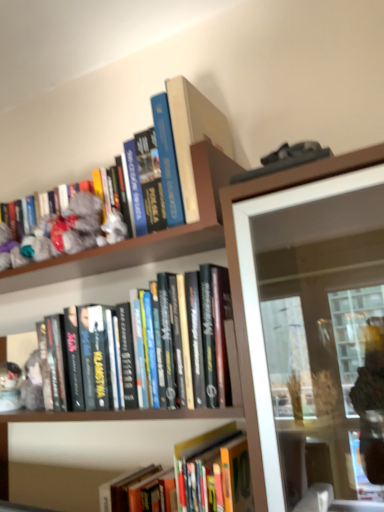
Question: Is hardcover books at center, which ranks as the 2th book in bottom-to-top order, oriented away from hardcover book at upper center, which appears as the 2th book when viewed from the top?

Choices:
 (A) yes
 (B) no

Answer: (B)

Question: From the image's perspective, is hardcover books at center, acting as the 3th book starting from the top, above hardcover book at upper center, the 3th book from the bottom?

Choices:
 (A) yes
 (B) no

Answer: (B)

Question: Is hardcover books at center, which ranks as the 2th book in bottom-to-top order, shorter than hardcover book at upper center, the 3th book from the bottom?

Choices:
 (A) no
 (B) yes

Answer: (A)

Question: Considering the relative sizes of hardcover books at center, which ranks as the 2th book in bottom-to-top order, and hardcover book at upper center, which appears as the 2th book when viewed from the top, in the image provided, is hardcover books at center, which ranks as the 2th book in bottom-to-top order, thinner than hardcover book at upper center, which appears as the 2th book when viewed from the top,?

Choices:
 (A) yes
 (B) no

Answer: (A)

Question: Is hardcover books at center, acting as the 3th book starting from the top, at the left side of hardcover book at upper center, the 3th book from the bottom?

Choices:
 (A) no
 (B) yes

Answer: (A)

Question: Is hardcover books at center, acting as the 3th book starting from the top, not near hardcover book at upper center, which appears as the 2th book when viewed from the top?

Choices:
 (A) no
 (B) yes

Answer: (A)

Question: Can we say fuzzy fabric toy at upper left lies outside hardcover book at upper center, the 1th book when ordered from top to bottom?

Choices:
 (A) yes
 (B) no

Answer: (A)

Question: Considering the relative sizes of fuzzy fabric toy at upper left and hardcover book at upper center, the 1th book when ordered from top to bottom, in the image provided, is fuzzy fabric toy at upper left taller than hardcover book at upper center, the 1th book when ordered from top to bottom,?

Choices:
 (A) no
 (B) yes

Answer: (A)

Question: Is fuzzy fabric toy at upper left far from hardcover book at upper center, which is the 4th book in bottom-to-top order?

Choices:
 (A) no
 (B) yes

Answer: (A)

Question: Does fuzzy fabric toy at upper left come in front of hardcover book at upper center, the 1th book when ordered from top to bottom?

Choices:
 (A) no
 (B) yes

Answer: (A)

Question: Does fuzzy fabric toy at upper left have a lesser height compared to hardcover book at upper center, the 1th book when ordered from top to bottom?

Choices:
 (A) no
 (B) yes

Answer: (B)

Question: Is fuzzy fabric toy at upper left to the right of hardcover book at upper center, which is the 4th book in bottom-to-top order, from the viewer's perspective?

Choices:
 (A) yes
 (B) no

Answer: (B)

Question: Is hardcover book at upper center, the 3th book from the bottom, directly adjacent to hardcover books at center, acting as the 3th book starting from the top?

Choices:
 (A) yes
 (B) no

Answer: (B)